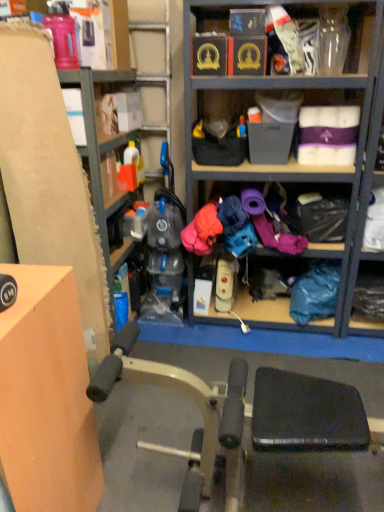
Question: Considering the relative sizes of blue fabric bag at lower right and matte cardboard box at left in the image provided, is blue fabric bag at lower right wider than matte cardboard box at left?

Choices:
 (A) yes
 (B) no

Answer: (B)

Question: Considering the relative sizes of blue fabric bag at lower right and matte cardboard box at left in the image provided, is blue fabric bag at lower right shorter than matte cardboard box at left?

Choices:
 (A) yes
 (B) no

Answer: (A)

Question: Would you say blue fabric bag at lower right is a long distance from matte cardboard box at left?

Choices:
 (A) no
 (B) yes

Answer: (B)

Question: Is blue fabric bag at lower right touching matte cardboard box at left?

Choices:
 (A) yes
 (B) no

Answer: (B)

Question: Is blue fabric bag at lower right positioned with its back to matte cardboard box at left?

Choices:
 (A) yes
 (B) no

Answer: (B)

Question: Relative to matte cardboard box at left, is orange matte table at left in front or behind?

Choices:
 (A) behind
 (B) front

Answer: (B)

Question: Is orange matte table at left wider or thinner than matte cardboard box at left?

Choices:
 (A) thin
 (B) wide

Answer: (B)

Question: Visually, is orange matte table at left positioned to the left or to the right of matte cardboard box at left?

Choices:
 (A) left
 (B) right

Answer: (A)

Question: From the image's perspective, is orange matte table at left above or below matte cardboard box at left?

Choices:
 (A) below
 (B) above

Answer: (A)

Question: Is matte cardboard box at left wider or thinner than orange matte table at left?

Choices:
 (A) wide
 (B) thin

Answer: (B)

Question: From the image's perspective, is matte cardboard box at left above or below orange matte table at left?

Choices:
 (A) above
 (B) below

Answer: (A)

Question: Do you think matte cardboard box at left is within orange matte table at left, or outside of it?

Choices:
 (A) outside
 (B) inside

Answer: (A)

Question: Is point (122, 11) positioned closer to the camera than point (94, 475)?

Choices:
 (A) closer
 (B) farther

Answer: (B)

Question: Looking at their shapes, would you say blue fabric bag at lower right is wider or thinner than matte cardboard box at left?

Choices:
 (A) wide
 (B) thin

Answer: (B)

Question: From the image's perspective, is blue fabric bag at lower right above or below matte cardboard box at left?

Choices:
 (A) below
 (B) above

Answer: (A)